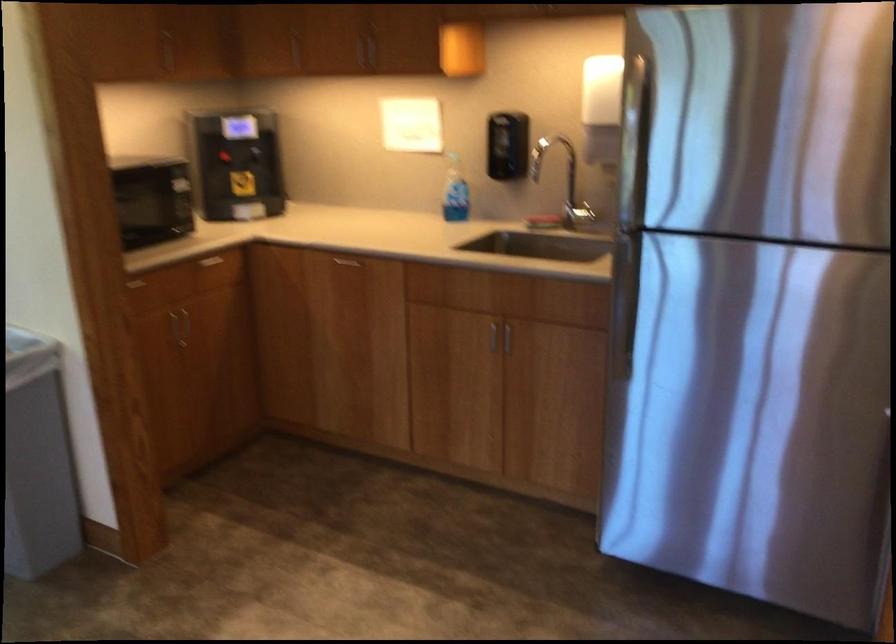
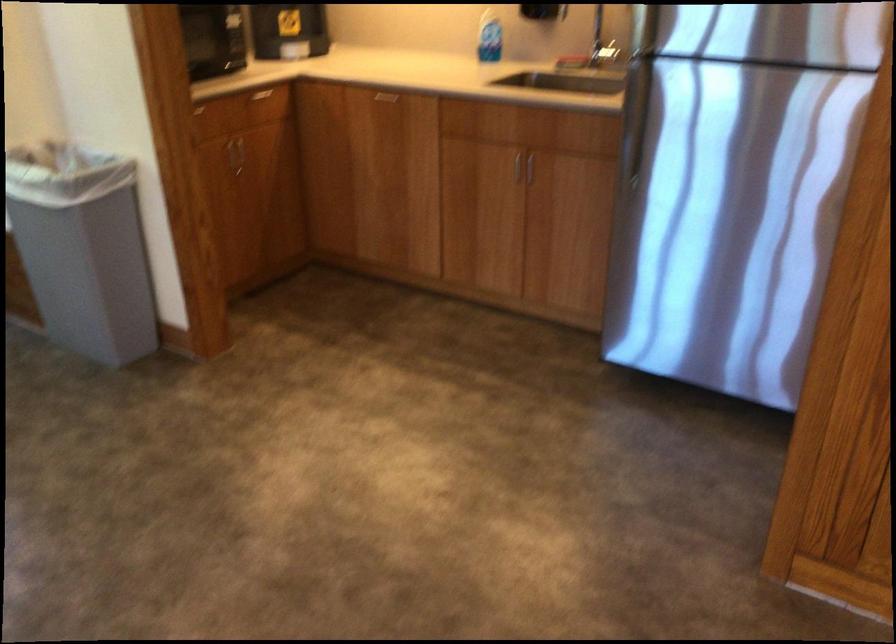
The point at [454,193] is marked in the first image. Where is the corresponding point in the second image?

(488, 37)